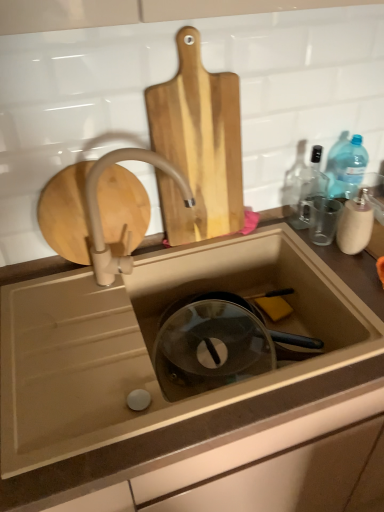
I want to click on vacant area that lies in front of white matte faucet at upper center, so click(106, 334).